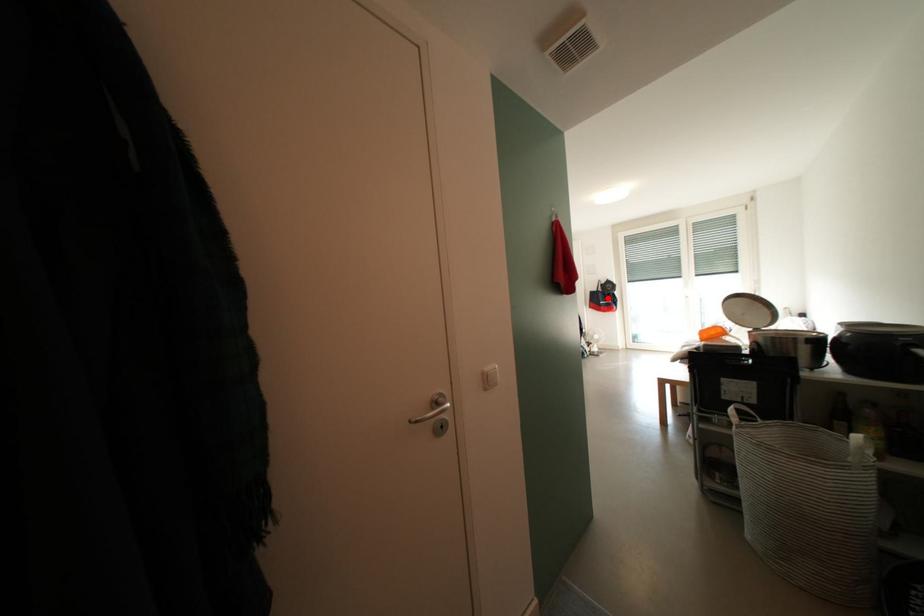
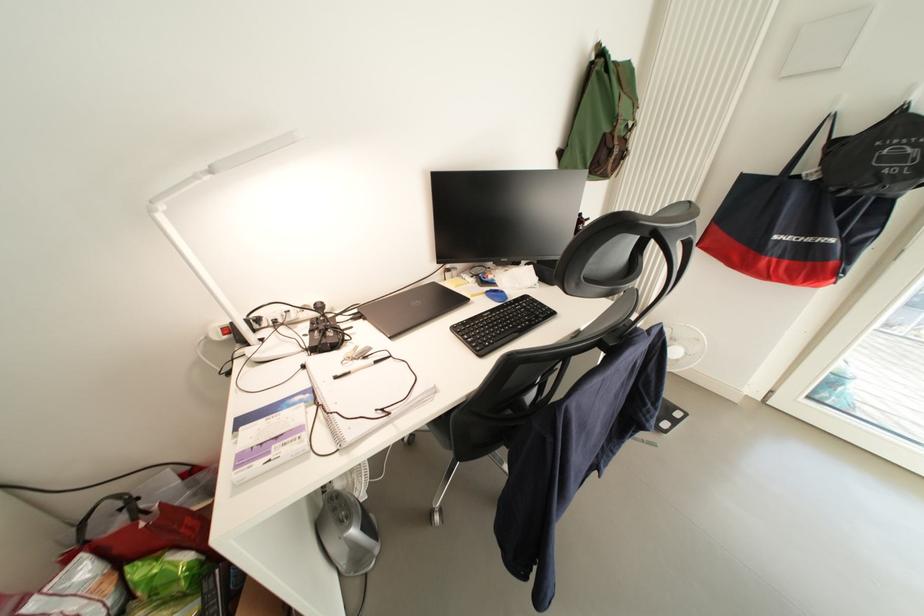
Question: I am providing you with two images of the same scene from different viewpoints. Given a red point in image1, look at the same physical point in image2. Is it:

Choices:
 (A) Closer to the viewpoint
 (B) Farther from the viewpoint

Answer: (A)